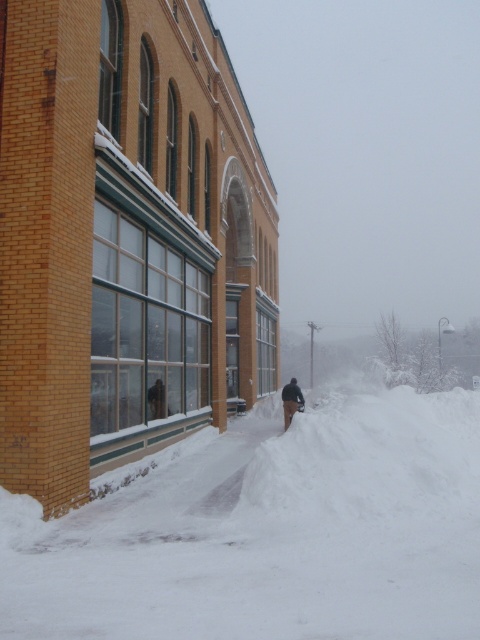
Question: Which of the following is the farthest from the observer?

Choices:
 (A) (72, 561)
 (B) (290, 417)

Answer: (B)

Question: Can you confirm if white fluffy snow at lower center is positioned below dark brown fur coat at lower center?

Choices:
 (A) yes
 (B) no

Answer: (B)

Question: Among these objects, which one is farthest from the camera?

Choices:
 (A) dark brown fur coat at lower center
 (B) white fluffy snow at lower center

Answer: (A)

Question: Does white fluffy snow at lower center come in front of dark brown fur coat at lower center?

Choices:
 (A) yes
 (B) no

Answer: (A)

Question: Which point is farther to the camera?

Choices:
 (A) (430, 440)
 (B) (284, 390)

Answer: (B)

Question: In this image, where is white fluffy snow at lower center located relative to dark brown fur coat at lower center?

Choices:
 (A) left
 (B) right

Answer: (B)